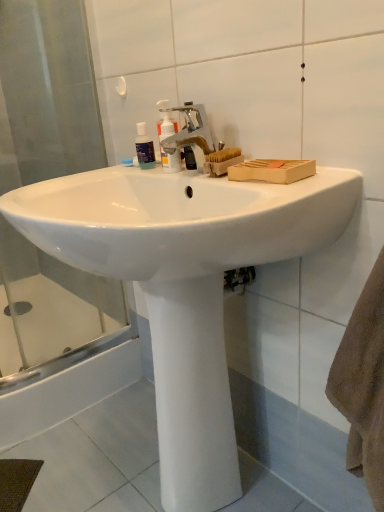
Question: Considering the relative positions of transparent plastic bottle at upper center and translucent plastic pump bottle at center in the image provided, is transparent plastic bottle at upper center in front of translucent plastic pump bottle at center?

Choices:
 (A) no
 (B) yes

Answer: (A)

Question: Considering the relative sizes of transparent plastic bottle at upper center and translucent plastic pump bottle at center in the image provided, is transparent plastic bottle at upper center smaller than translucent plastic pump bottle at center?

Choices:
 (A) yes
 (B) no

Answer: (A)

Question: From a real-world perspective, is transparent plastic bottle at upper center located beneath translucent plastic pump bottle at center?

Choices:
 (A) no
 (B) yes

Answer: (B)

Question: Considering the relative sizes of transparent plastic bottle at upper center and translucent plastic pump bottle at center in the image provided, is transparent plastic bottle at upper center taller than translucent plastic pump bottle at center?

Choices:
 (A) no
 (B) yes

Answer: (A)

Question: Is transparent plastic bottle at upper center bigger than translucent plastic pump bottle at center?

Choices:
 (A) no
 (B) yes

Answer: (A)

Question: Is transparent plastic bottle at upper center further to the viewer compared to translucent plastic pump bottle at center?

Choices:
 (A) yes
 (B) no

Answer: (A)

Question: Does transparent glass shower door at left have a lesser width compared to silver metallic faucet at center?

Choices:
 (A) yes
 (B) no

Answer: (A)

Question: Considering the relative positions of transparent glass shower door at left and silver metallic faucet at center in the image provided, is transparent glass shower door at left to the right of silver metallic faucet at center from the viewer's perspective?

Choices:
 (A) no
 (B) yes

Answer: (A)

Question: From a real-world perspective, is transparent glass shower door at left located beneath silver metallic faucet at center?

Choices:
 (A) yes
 (B) no

Answer: (A)

Question: Is there a large distance between transparent glass shower door at left and silver metallic faucet at center?

Choices:
 (A) no
 (B) yes

Answer: (A)

Question: From the image's perspective, is transparent glass shower door at left on top of silver metallic faucet at center?

Choices:
 (A) no
 (B) yes

Answer: (A)

Question: Considering the relative sizes of transparent glass shower door at left and silver metallic faucet at center in the image provided, is transparent glass shower door at left shorter than silver metallic faucet at center?

Choices:
 (A) yes
 (B) no

Answer: (B)

Question: Considering the relative sizes of white smooth pedestal at center and silver metallic faucet at center in the image provided, is white smooth pedestal at center shorter than silver metallic faucet at center?

Choices:
 (A) yes
 (B) no

Answer: (B)